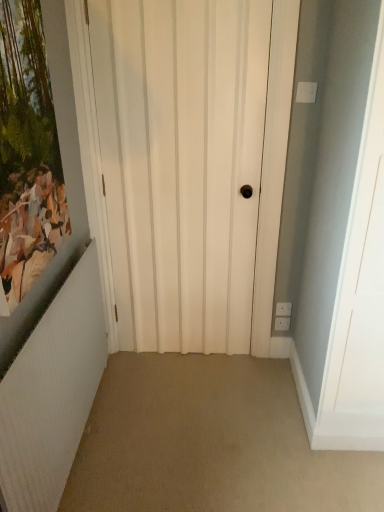
Question: From the image's perspective, is white textured radiator at left beneath white matte door at center?

Choices:
 (A) no
 (B) yes

Answer: (B)

Question: Can you confirm if white textured radiator at left is shorter than white matte door at center?

Choices:
 (A) yes
 (B) no

Answer: (A)

Question: Considering the relative positions of white textured radiator at left and white matte door at center in the image provided, is white textured radiator at left behind white matte door at center?

Choices:
 (A) no
 (B) yes

Answer: (A)

Question: From the image's perspective, does white textured radiator at left appear higher than white matte door at center?

Choices:
 (A) no
 (B) yes

Answer: (A)

Question: Would you say white matte door at center is part of white textured radiator at left's contents?

Choices:
 (A) yes
 (B) no

Answer: (B)

Question: From their relative heights in the image, would you say matte wooden picture frame at left is taller or shorter than white textured radiator at left?

Choices:
 (A) short
 (B) tall

Answer: (B)

Question: Is point (33, 1) closer or farther from the camera than point (67, 398)?

Choices:
 (A) closer
 (B) farther

Answer: (A)

Question: Do you think matte wooden picture frame at left is within white textured radiator at left, or outside of it?

Choices:
 (A) outside
 (B) inside

Answer: (A)

Question: Looking at their shapes, would you say matte wooden picture frame at left is wider or thinner than white textured radiator at left?

Choices:
 (A) wide
 (B) thin

Answer: (B)

Question: From a real-world perspective, is matte wooden picture frame at left positioned above or below white matte door at center?

Choices:
 (A) above
 (B) below

Answer: (A)

Question: Choose the correct answer: Is matte wooden picture frame at left inside white matte door at center or outside it?

Choices:
 (A) outside
 (B) inside

Answer: (A)

Question: Does point (8, 311) appear closer or farther from the camera than point (139, 138)?

Choices:
 (A) farther
 (B) closer

Answer: (B)

Question: Is matte wooden picture frame at left bigger or smaller than white matte door at center?

Choices:
 (A) big
 (B) small

Answer: (B)

Question: In the image, is white matte door at center positioned in front of or behind white textured radiator at left?

Choices:
 (A) front
 (B) behind

Answer: (B)

Question: Does point (129, 224) appear closer or farther from the camera than point (51, 366)?

Choices:
 (A) farther
 (B) closer

Answer: (A)